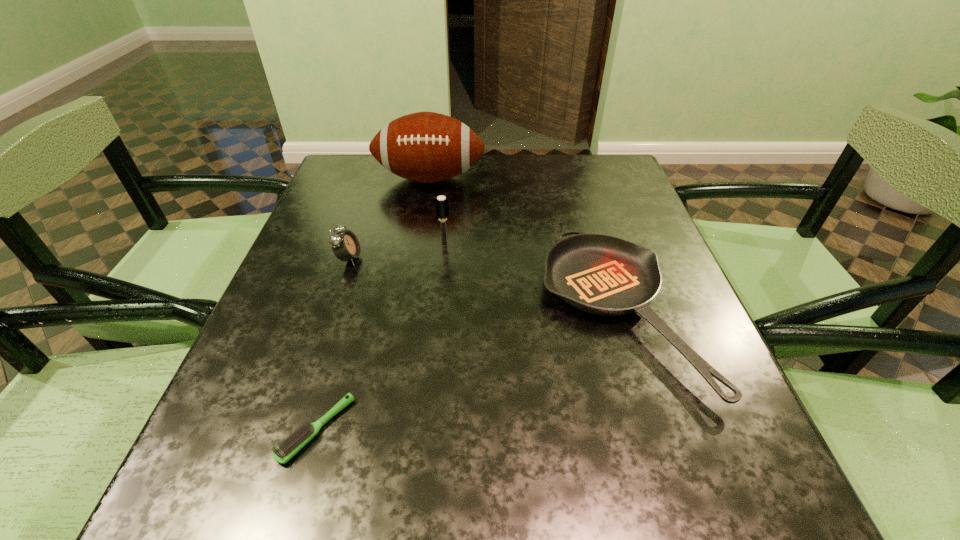
Locate an element on the screen. The width and height of the screenshot is (960, 540). free location located on the right of the farther hairbrush is located at coordinates (x=607, y=245).

At what (x,y) coordinates should I click in order to perform the action: click on vacant space located on the face of the alarm clock. Please return your answer as a coordinate pair (x, y). Image resolution: width=960 pixels, height=540 pixels. Looking at the image, I should click on (465, 258).

Identify the location of vacant space located 0.060m on the left of the rightmost object. The image size is (960, 540). (513, 313).

I want to click on free spot located on the left of the shortest object, so click(x=237, y=429).

At what (x,y) coordinates should I click in order to perform the action: click on object present at the far edge. Please return your answer as a coordinate pair (x, y). This screenshot has width=960, height=540. Looking at the image, I should click on (427, 147).

The height and width of the screenshot is (540, 960). I want to click on object situated at the near edge, so point(297,440).

The width and height of the screenshot is (960, 540). Find the location of `football at the left edge`. football at the left edge is located at coordinates point(427,147).

You are a GUI agent. You are given a task and a screenshot of the screen. Output one action in this format:
    pyautogui.click(x=<x>, y=<y>)
    Task: Click on the alarm clock situated at the left edge
    The height and width of the screenshot is (540, 960).
    Given the screenshot: What is the action you would take?
    pyautogui.click(x=345, y=245)

Where is `hairbrush positioned at the left edge`? This screenshot has width=960, height=540. hairbrush positioned at the left edge is located at coordinates (297, 440).

At what (x,y) coordinates should I click in order to perform the action: click on object that is at the right edge. Please return your answer as a coordinate pair (x, y). The width and height of the screenshot is (960, 540). Looking at the image, I should click on (600, 274).